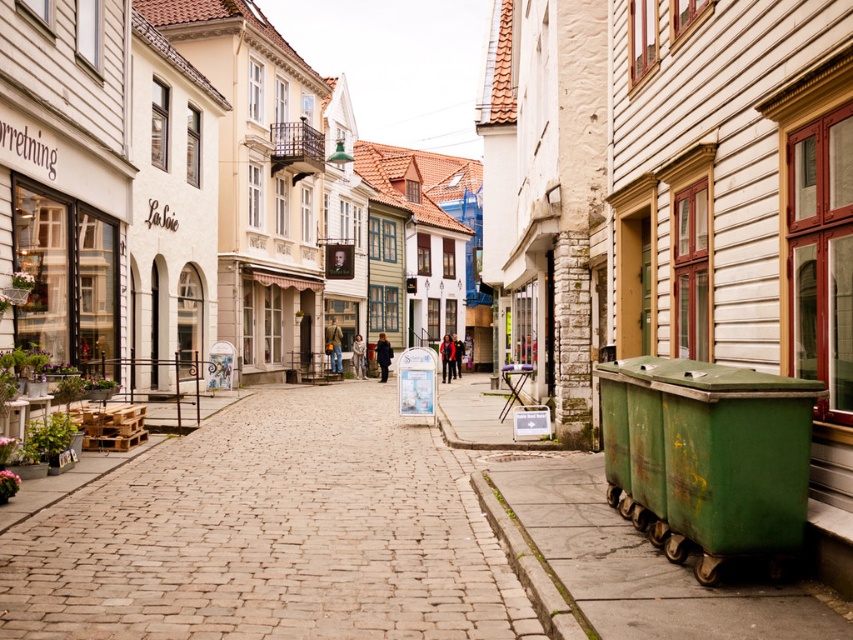
You are a delivery person trying to park your small electric cart that can only fit in tight spaces. You see the brown cobblestone at center and the green metallic dumpster at lower right. Which object takes up more space in the street?

The brown cobblestone at center takes up more space in the street than the green metallic dumpster at lower right because it has a larger size compared to it.

Based on the photo, you are a delivery person trying to park your bike near the green metallic dumpster at lower right without blocking the brown cobblestone at center. Based on the scene, where should you position your bike?

The brown cobblestone at center is located below the green metallic dumpster at lower right, so you should position your bike above the green metallic dumpster at lower right to avoid blocking the brown cobblestone at center.

You are a delivery person with a cart that is 2 meters wide. You need to maneuver your cart through the space between the brown cobblestone at center and the green metallic dumpster at lower right. Can your cart fit through the space between them?

The distance between the brown cobblestone at center and the green metallic dumpster at lower right is 6.23 meters. Since your cart is only 2 meters wide, it can easily fit through the space between them.